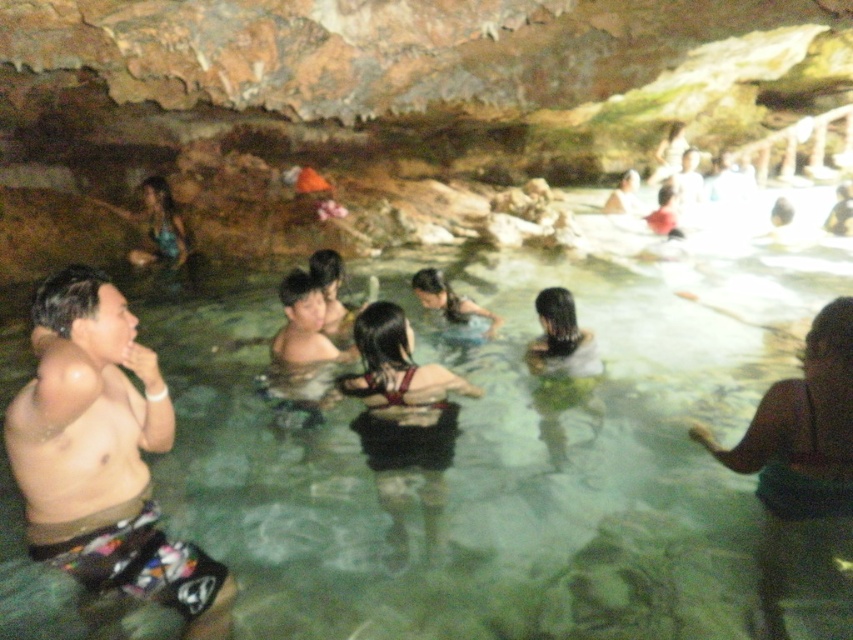
Which is behind, point (45, 332) or point (432, 272)?

Point (432, 272)

Is the position of skinny brown shorts at left less distant than that of dark brown hair at center?

Yes.

Measure the distance between skinny brown shorts at left and camera.

A distance of 6.83 feet exists between skinny brown shorts at left and camera.

The image size is (853, 640). I want to click on skinny brown shorts at left, so click(x=103, y=456).

Does clear water pool at center have a lesser height compared to dark brown hair at center?

Yes, clear water pool at center is shorter than dark brown hair at center.

Which is behind, point (675, 632) or point (489, 333)?

Positioned behind is point (489, 333).

The height and width of the screenshot is (640, 853). Identify the location of clear water pool at center. (518, 465).

Is dark red bikini top at center thinner than dark brown hair at upper right?

In fact, dark red bikini top at center might be wider than dark brown hair at upper right.

Who is shorter, dark red bikini top at center or dark brown hair at upper right?

dark brown hair at upper right

Is point (381, 374) positioned behind point (850, 224)?

No.

Locate an element on the screen. The width and height of the screenshot is (853, 640). dark red bikini top at center is located at coordinates (402, 410).